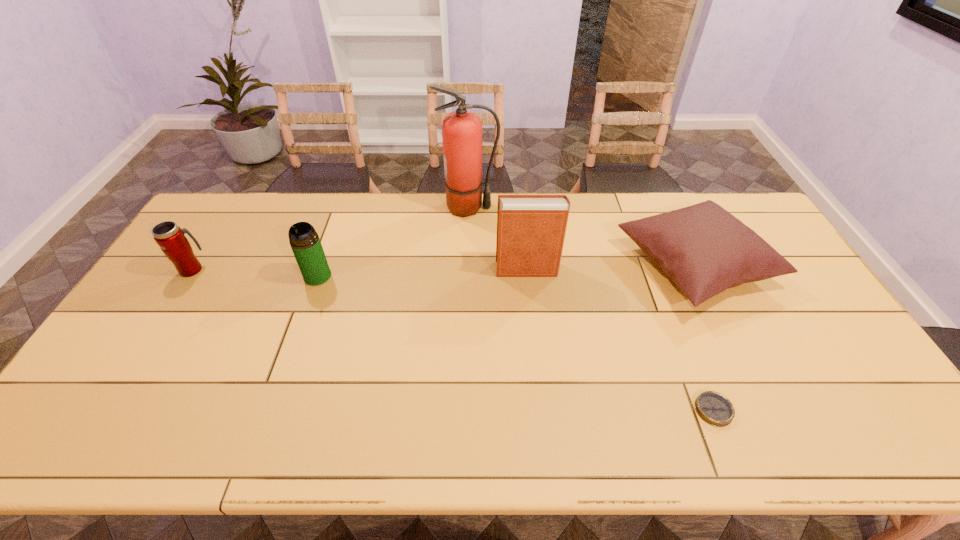
Find the location of `fire extinguisher`. fire extinguisher is located at coordinates (461, 130).

At what (x,y) coordinates should I click in order to perform the action: click on hardback book. Please return your answer as a coordinate pair (x, y). Looking at the image, I should click on [531, 229].

Identify the location of the taller thermos bottle. (305, 243).

Where is `the right thermos bottle`? The image size is (960, 540). the right thermos bottle is located at coordinates (305, 243).

Find the location of a particular element. This screenshot has height=540, width=960. the shorter thermos bottle is located at coordinates (170, 237).

Find the location of a particular element. the leftmost object is located at coordinates (170, 237).

Find the location of `cushion`. cushion is located at coordinates 704,249.

Identify the location of the shortest object. [714, 408].

Where is `the nearest object`? the nearest object is located at coordinates (714, 408).

In order to click on vacant space located 0.100m on the nozzle of the fire extinguisher in this screenshot , I will do `click(525, 207)`.